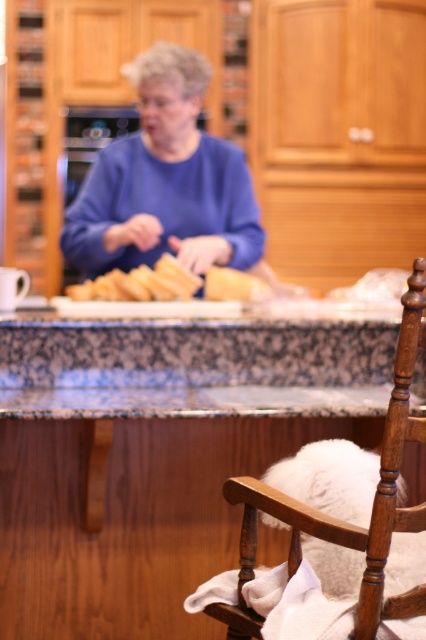
Question: Among these points, which one is farthest from the camera?

Choices:
 (A) (144, 237)
 (B) (124, 276)

Answer: (A)

Question: Is wooden rocking chair at lower right bigger than golden brown bread at center?

Choices:
 (A) no
 (B) yes

Answer: (B)

Question: Is blue matte sweater at center closer to the viewer compared to golden brown bread at center?

Choices:
 (A) no
 (B) yes

Answer: (A)

Question: Which point appears farthest from the camera in this image?

Choices:
 (A) (181, 278)
 (B) (158, 145)
 (C) (416, 515)

Answer: (B)

Question: Is blue matte sweater at center further to camera compared to golden brown bread at center?

Choices:
 (A) no
 (B) yes

Answer: (B)

Question: Which object appears farthest from the camera in this image?

Choices:
 (A) golden brown bread at center
 (B) wooden rocking chair at lower right
 (C) blue matte sweater at center

Answer: (C)